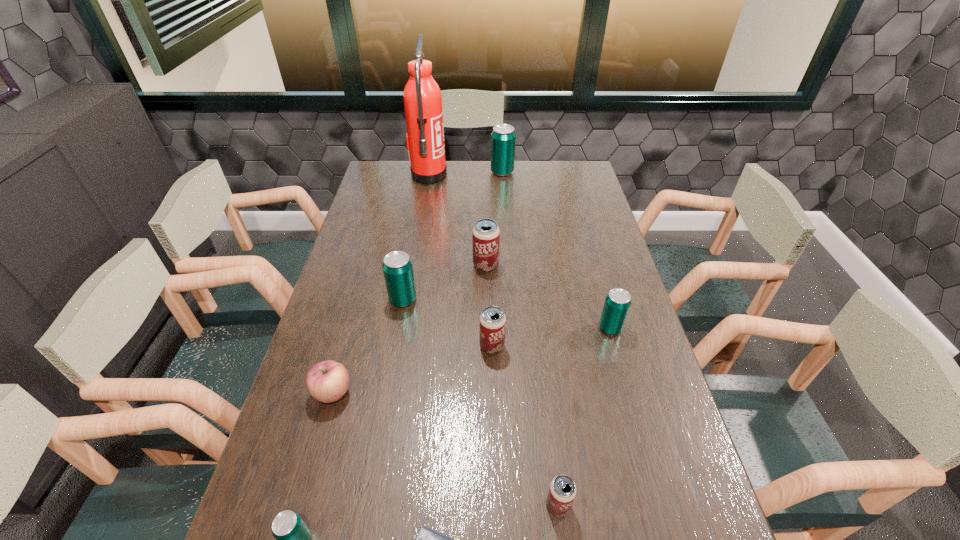
Locate an element on the screen. the fourth nearest object is located at coordinates (327, 381).

Where is `the nearest red beer can`? The image size is (960, 540). the nearest red beer can is located at coordinates (562, 491).

You are a GUI agent. You are given a task and a screenshot of the screen. Output one action in this format:
    pyautogui.click(x=<x>, y=<y>)
    Task: Click on the smallest red beer can
    
    Given the screenshot: What is the action you would take?
    pyautogui.click(x=562, y=491)

Where is `free region located 0.310m on the label side of the fire extinguisher`? free region located 0.310m on the label side of the fire extinguisher is located at coordinates (519, 176).

I want to click on vacant space located on the front of the ninth shortest object, so click(x=504, y=201).

You are a GUI agent. You are given a task and a screenshot of the screen. Output one action in this format:
    pyautogui.click(x=<x>, y=<y>)
    Task: Click on the free space located 0.230m on the back of the third smallest teal beer can
    Image resolution: width=960 pixels, height=540 pixels.
    Given the screenshot: What is the action you would take?
    pyautogui.click(x=413, y=244)

Where is `vacant space situated on the right of the farthest red beer can`? Image resolution: width=960 pixels, height=540 pixels. vacant space situated on the right of the farthest red beer can is located at coordinates (535, 265).

This screenshot has height=540, width=960. I want to click on free space located 0.350m on the back of the second nearest red beer can, so click(490, 256).

Locate an element on the screen. This screenshot has width=960, height=540. vacant space situated 0.240m on the left of the rightmost beer can is located at coordinates tap(516, 328).

Identify the location of free space located 0.320m on the right of the seventh farthest object. (479, 393).